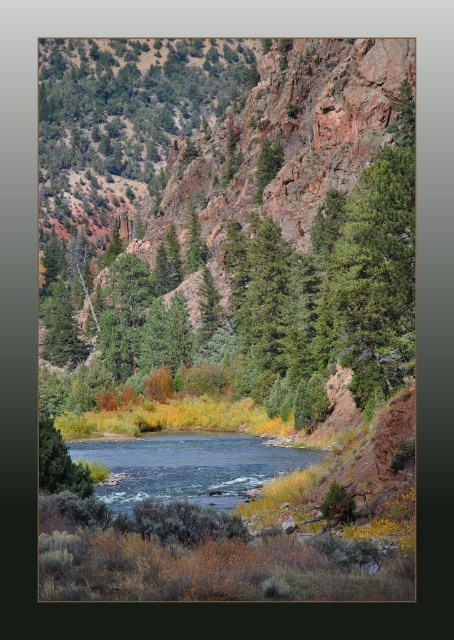
Question: Does green coniferous trees at center have a lesser width compared to greenish-blue water at center?

Choices:
 (A) yes
 (B) no

Answer: (B)

Question: Does green coniferous trees at center have a greater width compared to greenish-blue water at center?

Choices:
 (A) yes
 (B) no

Answer: (A)

Question: Can you confirm if green coniferous trees at center is positioned to the right of greenish-blue water at center?

Choices:
 (A) yes
 (B) no

Answer: (B)

Question: Which point is closer to the camera?

Choices:
 (A) green coniferous trees at center
 (B) greenish-blue water at center

Answer: (B)